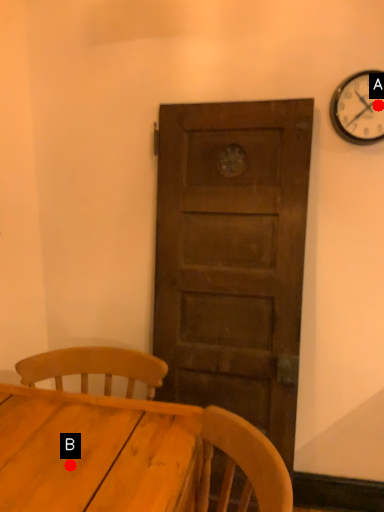
Question: Two points are circled on the image, labeled by A and B beside each circle. Which point is closer to the camera?

Choices:
 (A) A is closer
 (B) B is closer

Answer: (B)